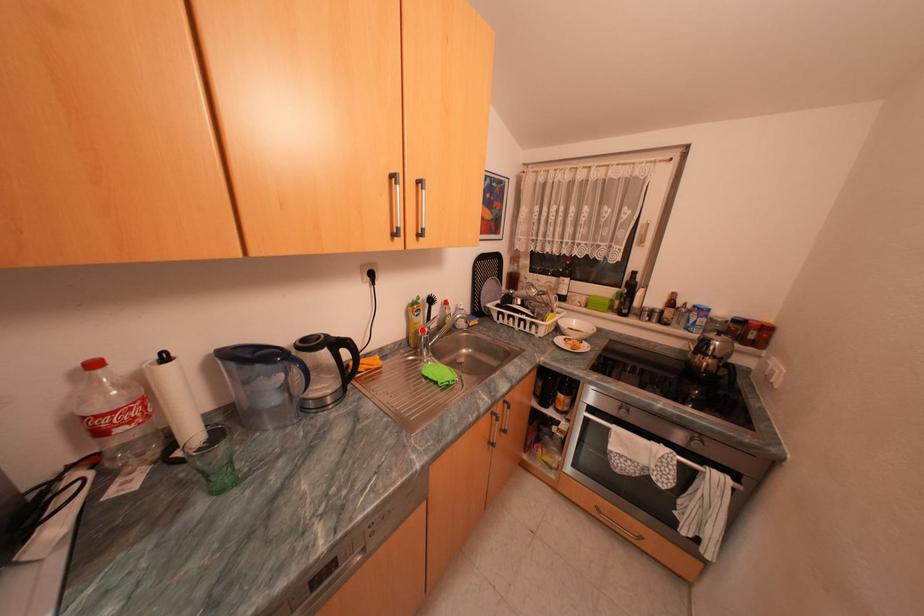
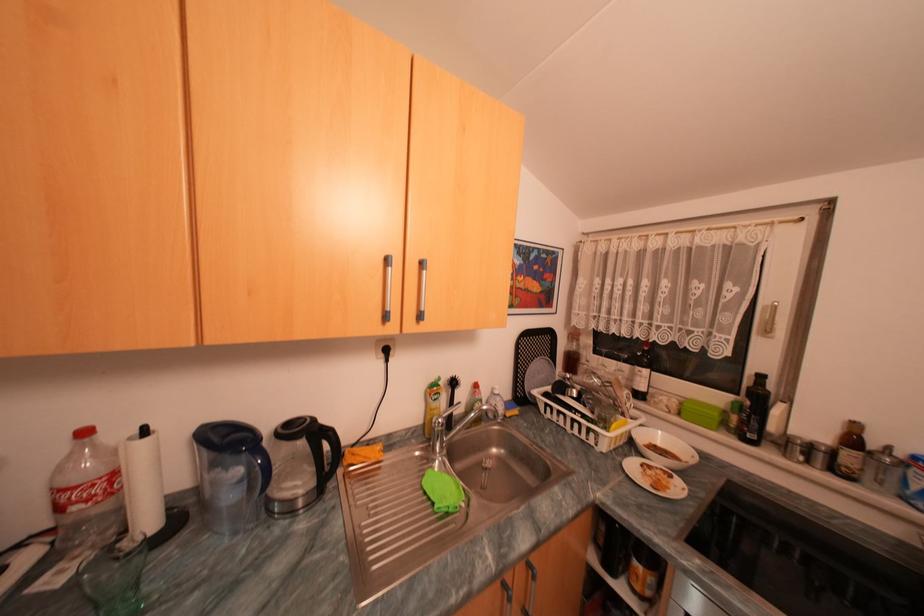
Question: I am providing you with two images of the same scene from different viewpoints. A red point is shown in image1. For the corresponding object point in image2, is it positioned nearer or farther from the camera?

Choices:
 (A) Nearer
 (B) Farther

Answer: (B)